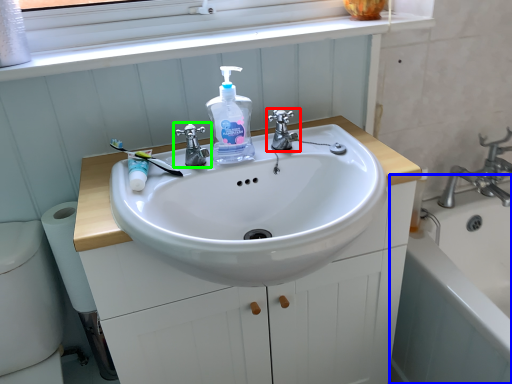
Question: Which is farther away from tap (highlighted by a red box)? bath (highlighted by a blue box) or tap (highlighted by a green box)?

Choices:
 (A) bath
 (B) tap

Answer: (A)